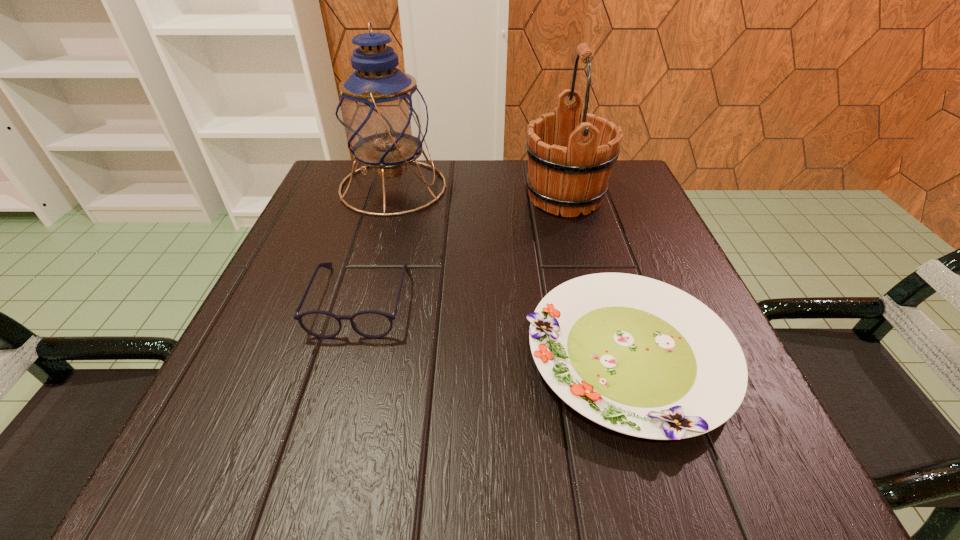
Where is `lantern`? This screenshot has width=960, height=540. lantern is located at coordinates (381, 114).

Locate an element on the screen. This screenshot has height=540, width=960. wine bucket is located at coordinates (569, 162).

Locate an element on the screen. The width and height of the screenshot is (960, 540). spectacles is located at coordinates point(373,324).

The image size is (960, 540). What are the coordinates of `the shortest object` in the screenshot? It's located at (636, 355).

Image resolution: width=960 pixels, height=540 pixels. What are the coordinates of `blank area located 0.300m on the front-facing side of the lantern` in the screenshot? It's located at (575, 187).

At what (x,y) coordinates should I click in order to perform the action: click on free space located on the front of the wine bucket. Please return your answer as a coordinate pair (x, y). Image resolution: width=960 pixels, height=540 pixels. Looking at the image, I should click on (603, 340).

Where is `free spot located 0.110m on the front-facing side of the second shortest object`? The image size is (960, 540). free spot located 0.110m on the front-facing side of the second shortest object is located at coordinates (332, 401).

This screenshot has height=540, width=960. Identify the location of blank area located 0.370m on the back of the shortest object. (574, 180).

Find the location of a particular element. This screenshot has height=540, width=960. lantern situated at the far edge is located at coordinates (381, 114).

Find the location of `wine bucket positioned at the far edge`. wine bucket positioned at the far edge is located at coordinates (569, 162).